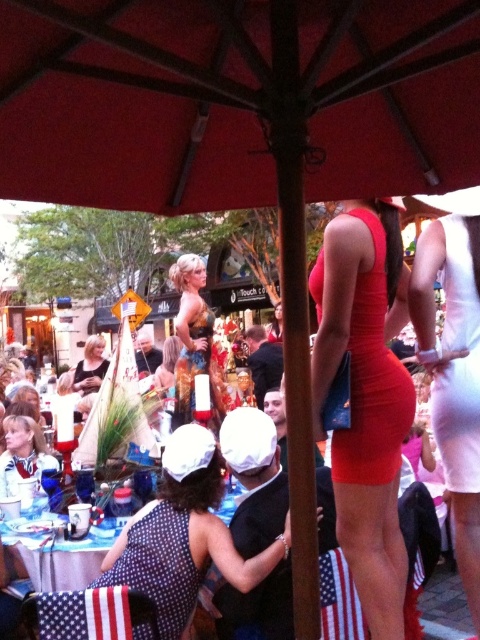
Question: Can you confirm if polka dot fabric dress at lower center is positioned above gold sequined dress at center?

Choices:
 (A) no
 (B) yes

Answer: (A)

Question: Is gold sequined dress at center wider than blonde hair at center?

Choices:
 (A) yes
 (B) no

Answer: (B)

Question: Which point is closer to the camera?

Choices:
 (A) polka dot fabric dress at center
 (B) polka dot fabric dress at lower center
 (C) blonde hair at center
 (D) white satin dress at center

Answer: (A)

Question: Is white satin dress at center above matte red dress at center?

Choices:
 (A) yes
 (B) no

Answer: (B)

Question: Considering the real-world distances, which object is farthest from the blonde hair at center?

Choices:
 (A) matte red dress at center
 (B) white satin dress at center
 (C) gold sequined dress at center
 (D) polka dot fabric dress at lower center

Answer: (A)

Question: Which object is the farthest from the gold sequined dress at center?

Choices:
 (A) matte red dress at center
 (B) polka dot fabric dress at lower center

Answer: (A)